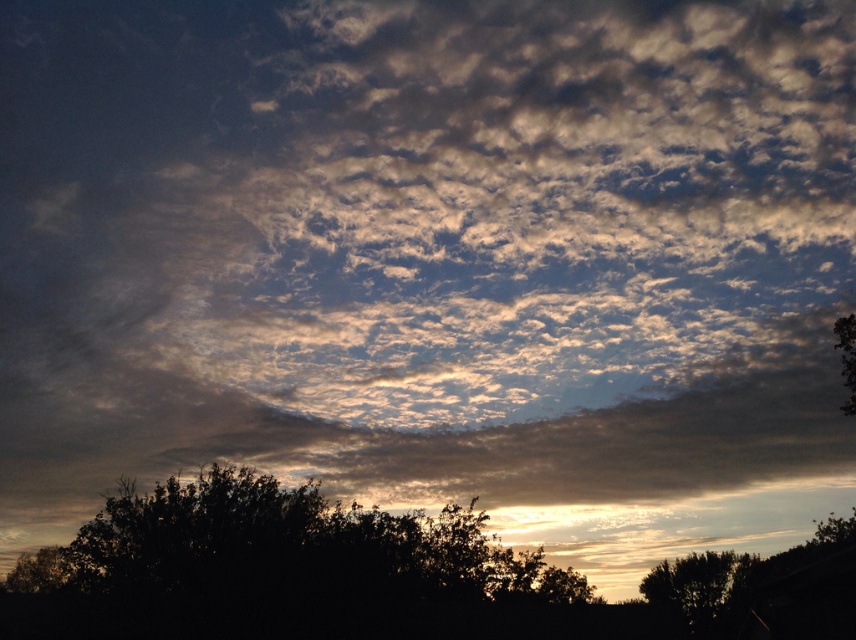
Question: Which point is farther to the camera?

Choices:
 (A) (675, 604)
 (B) (199, 538)

Answer: (A)

Question: From the image, what is the correct spatial relationship of dark green leafy tree at lower center in relation to silhouette leafy tree at lower right?

Choices:
 (A) right
 (B) left

Answer: (B)

Question: Is dark green leafy tree at lower center bigger than silhouette leafy tree at lower right?

Choices:
 (A) no
 (B) yes

Answer: (B)

Question: Can you confirm if dark green leafy tree at lower center is positioned below silhouette leafy tree at lower right?

Choices:
 (A) yes
 (B) no

Answer: (B)